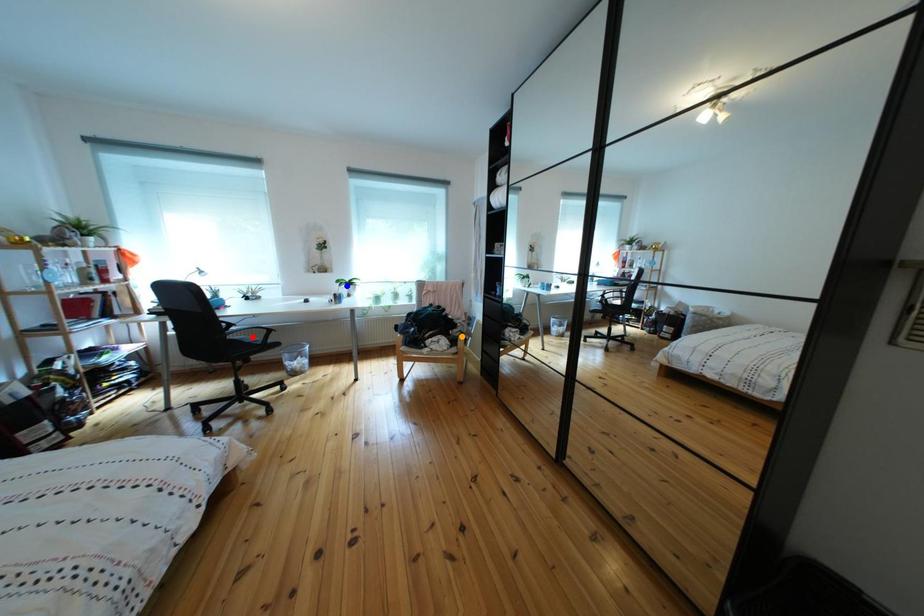
Order these from nearest to farthest:
A) red point
B) orange point
C) blue point

blue point → orange point → red point